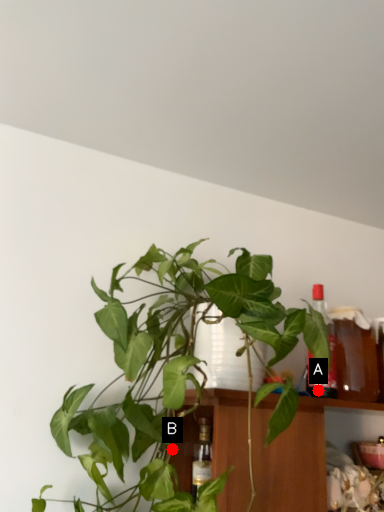
Question: Two points are circled on the image, labeled by A and B beside each circle. Which of the following is the closest to the observer?

Choices:
 (A) A is closer
 (B) B is closer

Answer: (A)